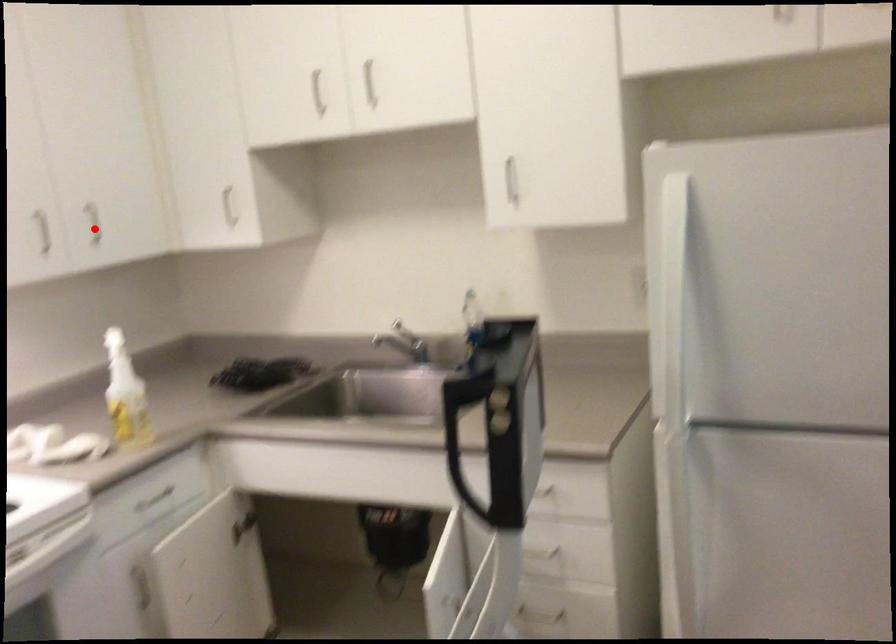
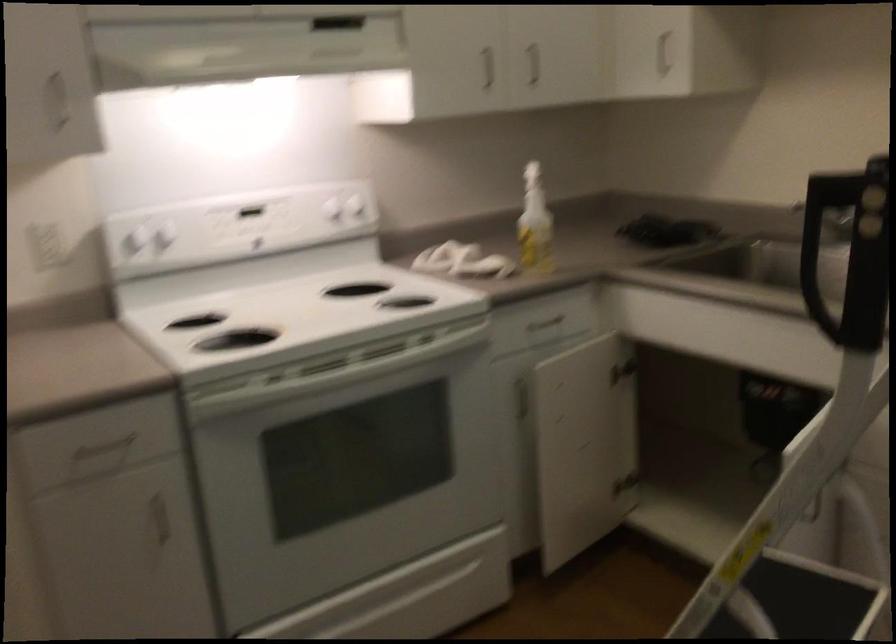
Where in the second image is the point corresponding to the highlighted location from the first image?

(531, 64)